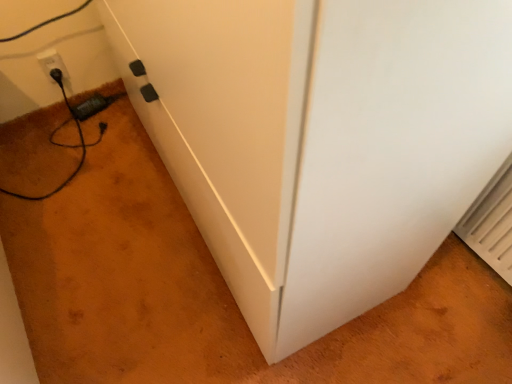
Question: From a real-world perspective, is white plastic outlet at lower left located higher than black plastic plug at lower left?

Choices:
 (A) no
 (B) yes

Answer: (B)

Question: Does white plastic outlet at lower left appear on the right side of black plastic plug at lower left?

Choices:
 (A) no
 (B) yes

Answer: (A)

Question: From the image's perspective, does white plastic outlet at lower left appear lower than black plastic plug at lower left?

Choices:
 (A) no
 (B) yes

Answer: (A)

Question: Is white plastic outlet at lower left smaller than black plastic plug at lower left?

Choices:
 (A) no
 (B) yes

Answer: (B)

Question: Would you consider white plastic outlet at lower left to be distant from black plastic plug at lower left?

Choices:
 (A) no
 (B) yes

Answer: (A)

Question: Is black plastic plug at lower left completely or partially inside white plastic outlet at lower left?

Choices:
 (A) no
 (B) yes

Answer: (A)

Question: Can you confirm if black plastic plug at lower left is thinner than white plastic outlet at lower left?

Choices:
 (A) yes
 (B) no

Answer: (B)

Question: Is black plastic plug at lower left directly adjacent to white plastic outlet at lower left?

Choices:
 (A) yes
 (B) no

Answer: (B)

Question: Considering the relative sizes of black plastic plug at lower left and white plastic outlet at lower left in the image provided, is black plastic plug at lower left taller than white plastic outlet at lower left?

Choices:
 (A) yes
 (B) no

Answer: (B)

Question: Is black plastic plug at lower left shorter than white plastic outlet at lower left?

Choices:
 (A) yes
 (B) no

Answer: (A)

Question: Is black plastic plug at lower left further to camera compared to white plastic outlet at lower left?

Choices:
 (A) yes
 (B) no

Answer: (A)

Question: Considering the relative positions of black plastic plug at lower left and white plastic outlet at lower left in the image provided, is black plastic plug at lower left to the right of white plastic outlet at lower left from the viewer's perspective?

Choices:
 (A) no
 (B) yes

Answer: (B)

Question: Which is correct: white plastic outlet at lower left is inside black plastic plug at lower left, or outside of it?

Choices:
 (A) inside
 (B) outside

Answer: (B)